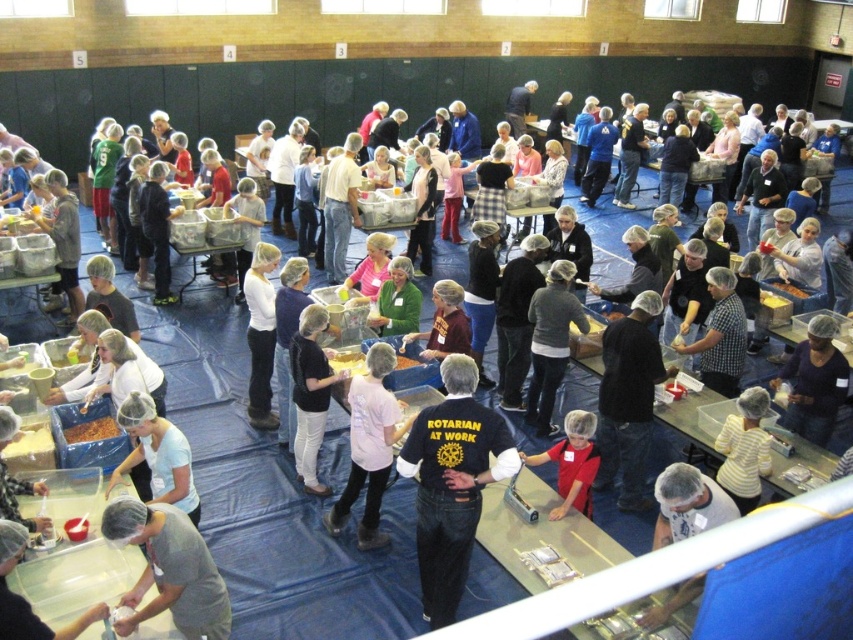
Which is below, black cotton shirt at center or pink fabric shirt at center?

black cotton shirt at center is lower down.

Find the location of a particular element. black cotton shirt at center is located at coordinates (451, 483).

Can you confirm if gray fabric shirt at lower left is taller than pink fabric shirt at center?

No.

Does gray fabric shirt at lower left appear on the left side of pink fabric shirt at center?

Yes, gray fabric shirt at lower left is to the left of pink fabric shirt at center.

Find the location of `gray fabric shirt at lower left`. gray fabric shirt at lower left is located at coordinates [x=169, y=568].

This screenshot has height=640, width=853. Find the location of `gray fabric shirt at lower left`. gray fabric shirt at lower left is located at coordinates (169, 568).

Is gray fabric shirt at lower left positioned at the back of white matte shirt at center?

No, gray fabric shirt at lower left is closer to the viewer.

Can you confirm if gray fabric shirt at lower left is positioned above white matte shirt at center?

No.

What do you see at coordinates (169, 568) in the screenshot? The image size is (853, 640). I see `gray fabric shirt at lower left` at bounding box center [169, 568].

Where is `gray fabric shirt at lower left`? The image size is (853, 640). gray fabric shirt at lower left is located at coordinates (169, 568).